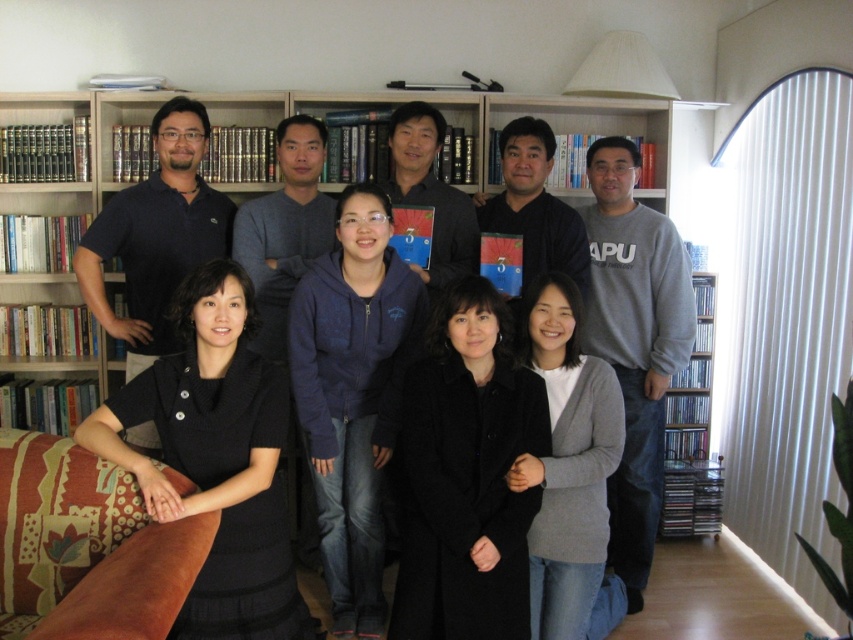
What do you see at coordinates (218, 460) in the screenshot? This screenshot has width=853, height=640. I see `black knit dress at center` at bounding box center [218, 460].

Where is `black knit dress at center`? black knit dress at center is located at coordinates (218, 460).

Locate an element on the screen. The image size is (853, 640). black knit dress at center is located at coordinates (218, 460).

Is gray cotton sweatshirt at right to the left of black matte jacket at center from the viewer's perspective?

No, gray cotton sweatshirt at right is not to the left of black matte jacket at center.

Does gray cotton sweatshirt at right have a smaller size compared to black matte jacket at center?

No.

The height and width of the screenshot is (640, 853). In order to click on gray cotton sweatshirt at right in this screenshot , I will do `click(634, 342)`.

Which of these two, dark blue fleece at center or gray cotton sweatshirt at right, stands shorter?

With less height is dark blue fleece at center.

Does point (305, 339) come in front of point (645, 392)?

Yes.

Is point (334, 492) closer to viewer compared to point (608, 216)?

Yes.

At what (x,y) coordinates should I click in order to perform the action: click on dark blue fleece at center. Please return your answer as a coordinate pair (x, y). The height and width of the screenshot is (640, 853). Looking at the image, I should click on (352, 394).